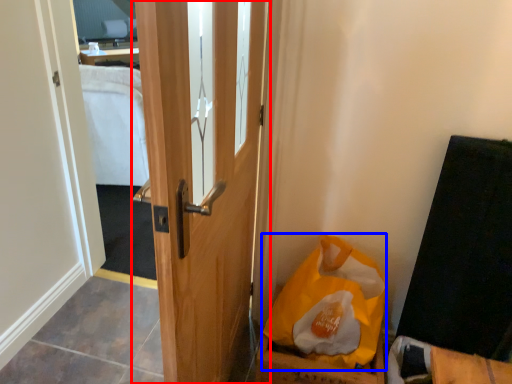
Question: Which object is closer to the camera taking this photo, door (highlighted by a red box) or paper bag (highlighted by a blue box)?

Choices:
 (A) door
 (B) paper bag

Answer: (A)